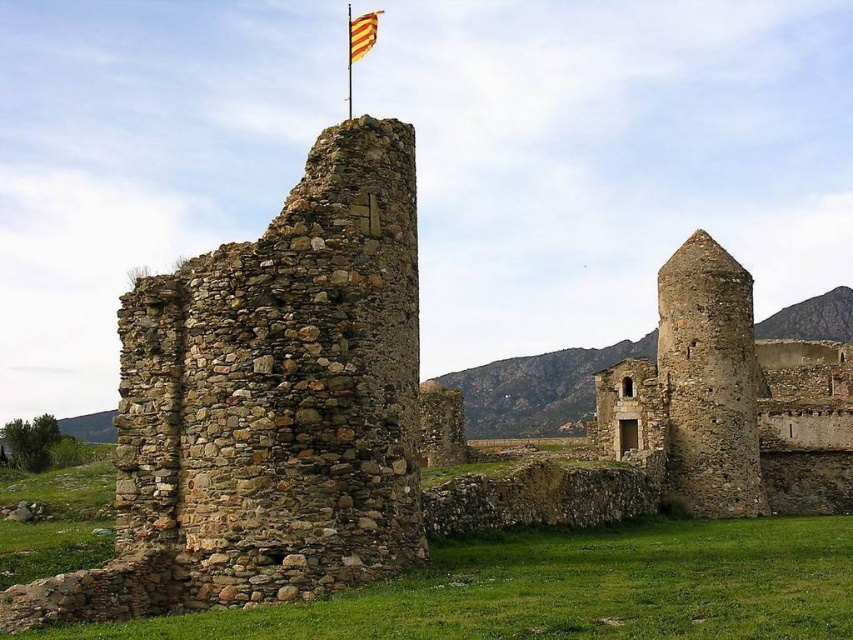
You are a historian examining the medieval ruins. You notice the stone tower at right and the yellow striped fabric at top. Which object is closer to the observer? Please explain your reasoning based on the scene description.

The stone tower at right is closer to the observer because the yellow striped fabric at top is described as being behind it, indicating that the tower is in front.

You are a historian examining the medieval ruins. You notice the stone tower at right and the yellow striped fabric at top. Which object is taller?

The yellow striped fabric at top is taller than the stone tower at right.

Based on the photo, you are standing at the center of the ruins and want to locate the stone tower at right. According to the coordinates provided, in which direction should you move to reach it?

The stone tower at right is located at coordinates point (730, 401), so you should move to the right to reach it.